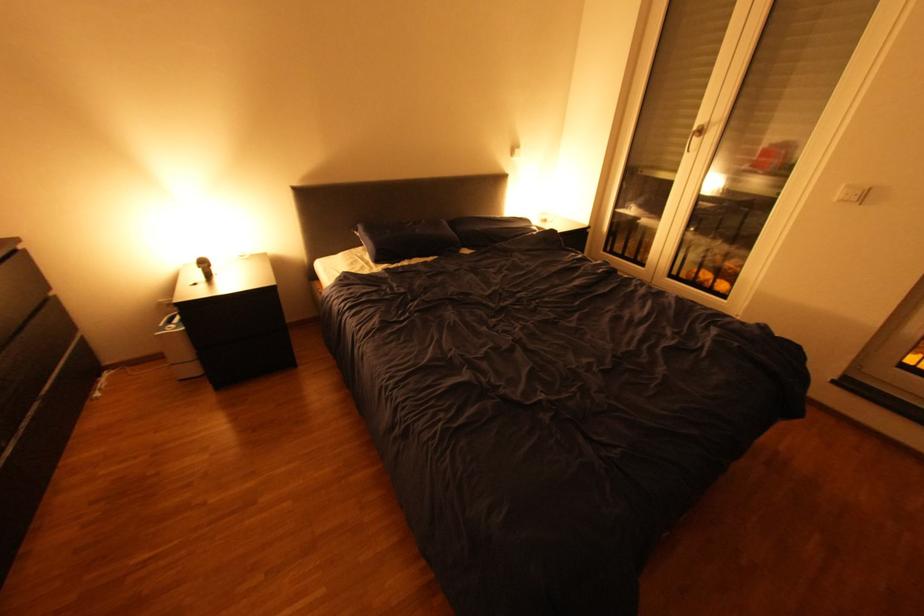
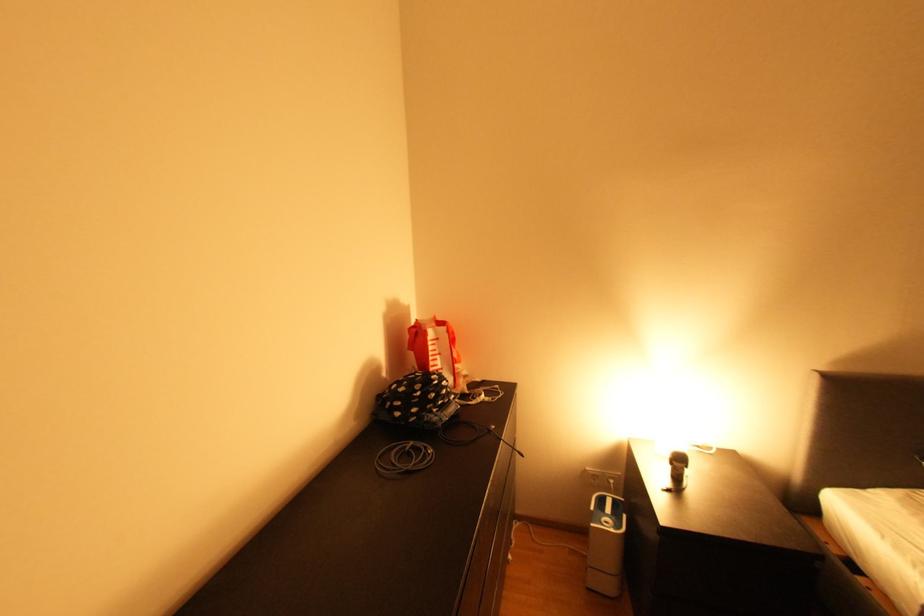
The point at (166, 334) is marked in the first image. Where is the corresponding point in the second image?

(602, 525)